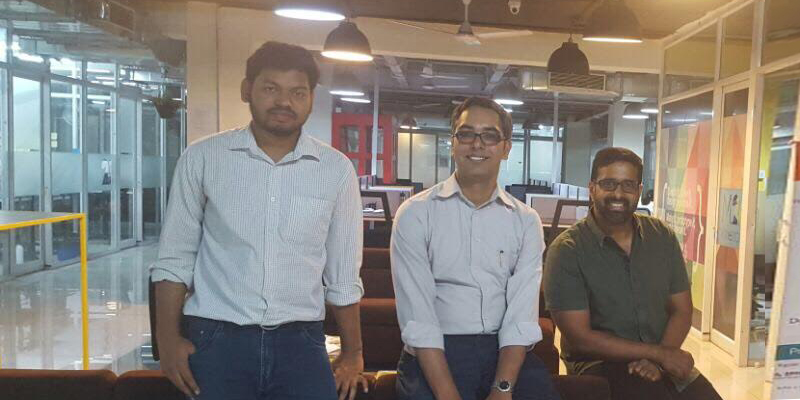
You are a GUI agent. You are given a task and a screenshot of the screen. Output one action in this format:
    pyautogui.click(x=<x>, y=<y>)
    Task: Click on the lights
    
    Given the screenshot: What is the action you would take?
    point(566,59), point(350,45), point(462,26), point(306,14)